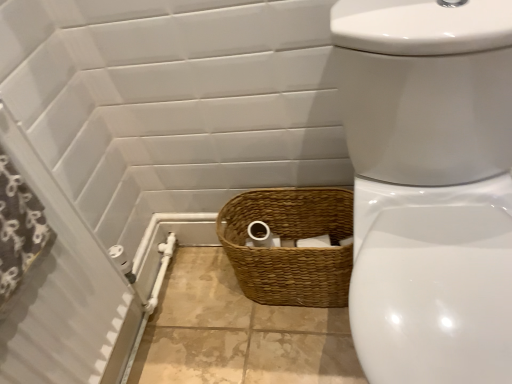
What is the approximate height of white textured screen door at left?

87.95 centimeters.

Based on the photo, in order to face white textured screen door at left, should I rotate leftwards or rightwards?

A 22.618 degree turn to the left will do.

What do you see at coordinates (429, 186) in the screenshot?
I see `white glossy toilet at center` at bounding box center [429, 186].

The width and height of the screenshot is (512, 384). I want to click on white textured screen door at left, so click(x=62, y=289).

Is black fabric shower curtain at left at the back of white textured screen door at left?

A: Yes, white textured screen door at left's orientation is away from black fabric shower curtain at left.

Would you say white textured screen door at left is to the left or to the right of black fabric shower curtain at left in the picture?

white textured screen door at left is positioned on black fabric shower curtain at left's right side.

Does white textured screen door at left have a smaller size compared to black fabric shower curtain at left?

Incorrect, white textured screen door at left is not smaller in size than black fabric shower curtain at left.

Is white textured screen door at left with black fabric shower curtain at left?

No, white textured screen door at left is not making contact with black fabric shower curtain at left.

Is brown woven basket at lower center looking in the opposite direction of white textured screen door at left?

brown woven basket at lower center is not turned away from white textured screen door at left.

Considering the sizes of brown woven basket at lower center and white textured screen door at left in the image, is brown woven basket at lower center taller or shorter than white textured screen door at left?

brown woven basket at lower center is shorter than white textured screen door at left.

Could white textured screen door at left be considered to be inside brown woven basket at lower center?

No, brown woven basket at lower center does not contain white textured screen door at left.

From a real-world perspective, which object stands above the other?

In real-world perspective, white textured screen door at left is above.

In order to click on toilet in front of the brown woven basket at lower center in this screenshot , I will do `click(429, 186)`.

Consider the image. From the image's perspective, is white glossy toilet at center over brown woven basket at lower center?

Indeed, from the image's perspective, white glossy toilet at center is shown above brown woven basket at lower center.

Between white glossy toilet at center and brown woven basket at lower center, which one has larger width?

With larger width is white glossy toilet at center.

Looking at this image, from a real-world perspective, between white glossy toilet at center and brown woven basket at lower center, who is vertically higher?

In real-world perspective, white glossy toilet at center is above.

From the image's perspective, is black fabric shower curtain at left located beneath white glossy toilet at center?

No, from the image's perspective, black fabric shower curtain at left is not below white glossy toilet at center.

From a real-world perspective, which object rests below the other?

white glossy toilet at center, from a real-world perspective.

Is black fabric shower curtain at left oriented towards white glossy toilet at center?

Yes, black fabric shower curtain at left is facing white glossy toilet at center.

What's the angular difference between black fabric shower curtain at left and white glossy toilet at center's facing directions?

They differ by 89.8 degrees in their facing directions.

Is black fabric shower curtain at left to the right of white textured screen door at left from the viewer's perspective?

No.

Consider the image. Between black fabric shower curtain at left and white textured screen door at left, which one has more height?

Standing taller between the two is white textured screen door at left.

How many degrees apart are the facing directions of black fabric shower curtain at left and white textured screen door at left?

black fabric shower curtain at left and white textured screen door at left are facing 0.00898 degrees away from each other.

From the image's perspective, does brown woven basket at lower center appear lower than white glossy toilet at center?

Indeed, from the image's perspective, brown woven basket at lower center is shown beneath white glossy toilet at center.

Can you confirm if brown woven basket at lower center is bigger than white glossy toilet at center?

Actually, brown woven basket at lower center might be smaller than white glossy toilet at center.

Can you confirm if brown woven basket at lower center is shorter than white glossy toilet at center?

Correct, brown woven basket at lower center is not as tall as white glossy toilet at center.

From a real-world perspective, is brown woven basket at lower center positioned above or below white glossy toilet at center?

In terms of real-world spatial position, brown woven basket at lower center is below white glossy toilet at center.

Considering the relative sizes of white textured screen door at left and white glossy toilet at center in the image provided, is white textured screen door at left taller than white glossy toilet at center?

Yes, white textured screen door at left is taller than white glossy toilet at center.

Is white textured screen door at left not inside white glossy toilet at center?

Absolutely, white textured screen door at left is external to white glossy toilet at center.

From a real-world perspective, does white textured screen door at left stand above white glossy toilet at center?

Yes, from a real-world perspective, white textured screen door at left is on top of white glossy toilet at center.

The width and height of the screenshot is (512, 384). I want to click on screen door lying below the black fabric shower curtain at left (from the image's perspective), so click(62, 289).

Image resolution: width=512 pixels, height=384 pixels. I want to click on screen door positioned vertically above the brown woven basket at lower center (from a real-world perspective), so click(62, 289).

Which object lies nearer to the anchor point brown woven basket at lower center, white textured screen door at left or white glossy toilet at center?

Based on the image, white glossy toilet at center appears to be nearer to brown woven basket at lower center.

Based on their spatial positions, is brown woven basket at lower center or white textured screen door at left further from white glossy toilet at center?

white textured screen door at left is further to white glossy toilet at center.

Based on the photo, estimate the real-world distances between objects in this image. Which object is closer to brown woven basket at lower center, white glossy toilet at center or black fabric shower curtain at left?

white glossy toilet at center lies closer to brown woven basket at lower center than the other object.

From the picture: Looking at the image, which one is located closer to white textured screen door at left, brown woven basket at lower center or white glossy toilet at center?

Based on the image, brown woven basket at lower center appears to be nearer to white textured screen door at left.

Which object lies further to the anchor point black fabric shower curtain at left, brown woven basket at lower center or white textured screen door at left?

Among the two, brown woven basket at lower center is located further to black fabric shower curtain at left.

From the image, which object appears to be nearer to black fabric shower curtain at left, white glossy toilet at center or brown woven basket at lower center?

Among the two, brown woven basket at lower center is located nearer to black fabric shower curtain at left.

Looking at this image, looking at the image, which one is located further to white glossy toilet at center, black fabric shower curtain at left or white textured screen door at left?

The object further to white glossy toilet at center is black fabric shower curtain at left.

Considering their positions, is black fabric shower curtain at left positioned closer to white textured screen door at left than white glossy toilet at center?

The object closer to white textured screen door at left is black fabric shower curtain at left.

This screenshot has width=512, height=384. Identify the location of basket located between white textured screen door at left and white glossy toilet at center in the left-right direction. (291, 245).

Image resolution: width=512 pixels, height=384 pixels. Identify the location of screen door located between black fabric shower curtain at left and brown woven basket at lower center in the left-right direction. (62, 289).

In order to click on screen door situated between black fabric shower curtain at left and white glossy toilet at center from left to right in this screenshot , I will do 62,289.

The width and height of the screenshot is (512, 384). I want to click on basket between black fabric shower curtain at left and white glossy toilet at center, so click(x=291, y=245).